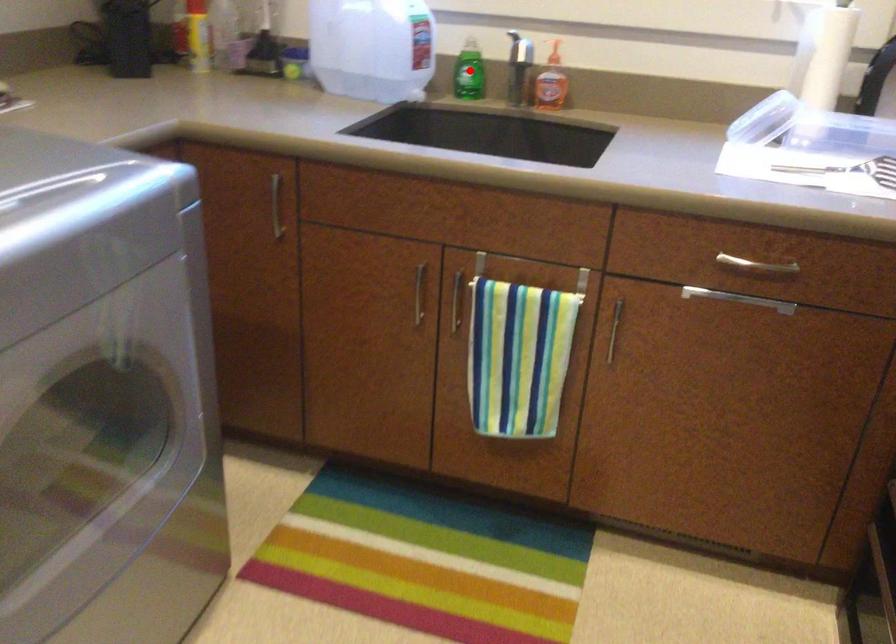
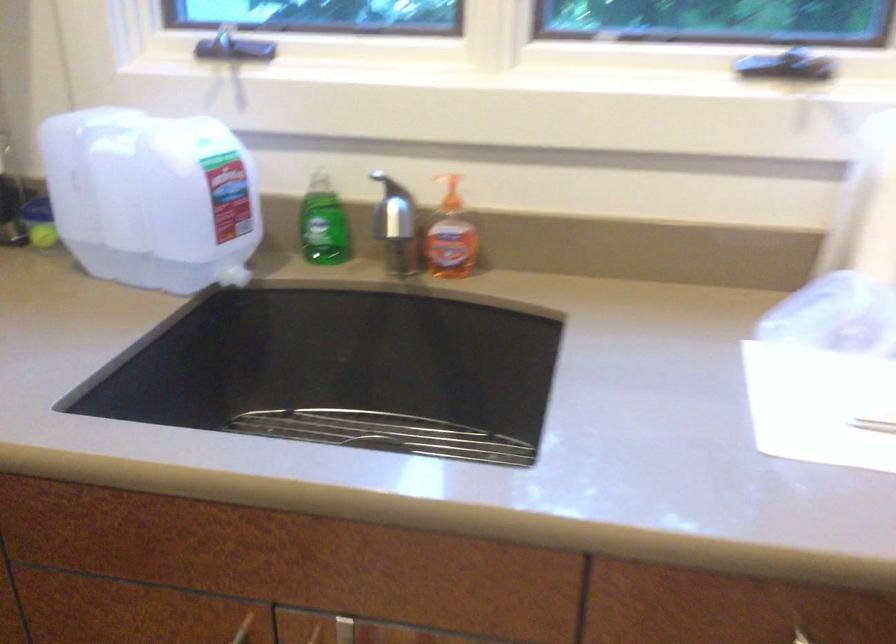
The point at the highlighted location is marked in the first image. Where is the corresponding point in the second image?

(323, 223)